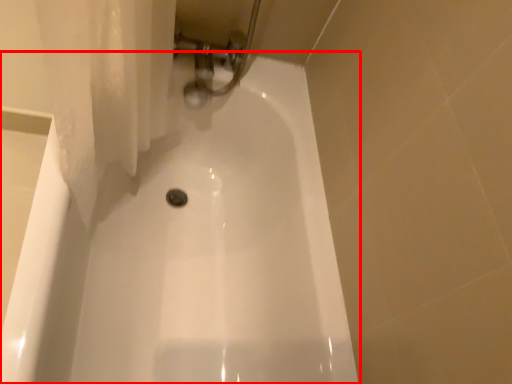
Question: Observing the image, what is the correct spatial positioning of bathtub (annotated by the red box) in reference to plumbing fixture?

Choices:
 (A) left
 (B) right

Answer: (A)